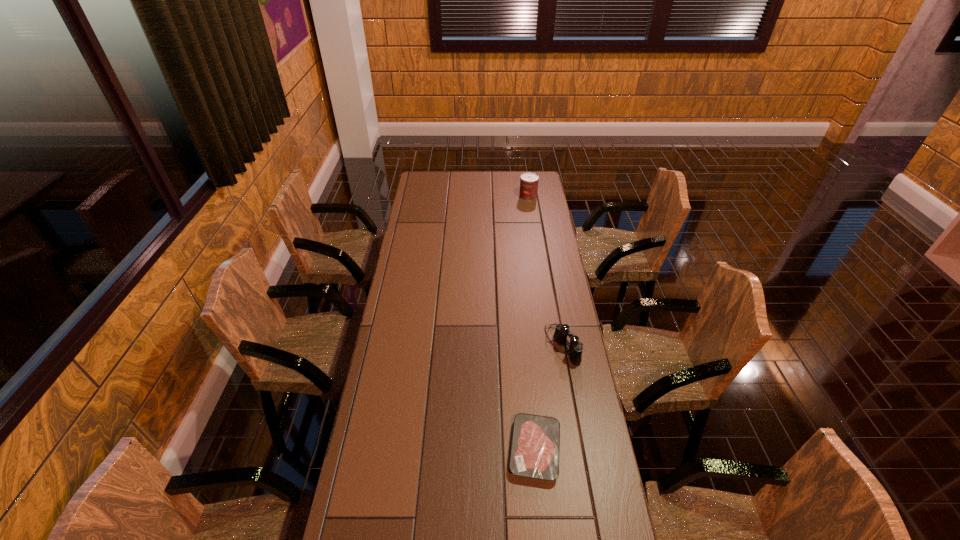
At what (x,y) coordinates should I click in order to perform the action: click on the farthest object. Please return your answer as a coordinate pair (x, y). Image resolution: width=960 pixels, height=540 pixels. Looking at the image, I should click on (529, 181).

This screenshot has height=540, width=960. I want to click on the tallest object, so click(529, 181).

Where is `the second shortest object`? The height and width of the screenshot is (540, 960). the second shortest object is located at coordinates (562, 331).

Locate an element on the screen. binoculars is located at coordinates (562, 331).

This screenshot has width=960, height=540. I want to click on the nearest object, so click(x=535, y=447).

The width and height of the screenshot is (960, 540). What are the coordinates of `steak` in the screenshot? It's located at pyautogui.click(x=535, y=447).

The height and width of the screenshot is (540, 960). Identify the location of blank space located on the front of the can. (534, 233).

You are a GUI agent. You are given a task and a screenshot of the screen. Output one action in this format:
    pyautogui.click(x=<x>, y=<y>)
    Task: Click on the free space located on the left of the second farthest object
    Image resolution: width=960 pixels, height=540 pixels.
    Given the screenshot: What is the action you would take?
    pyautogui.click(x=530, y=345)

The width and height of the screenshot is (960, 540). Identify the location of vacant space located 0.270m on the left of the steak. (419, 449).

The width and height of the screenshot is (960, 540). I want to click on object at the far edge, so [x=529, y=181].